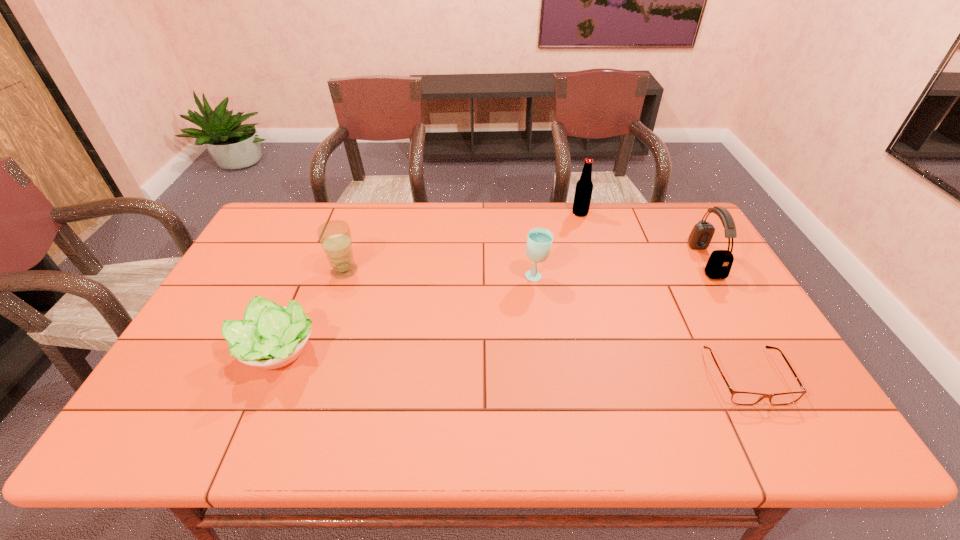
At what (x,y) coordinates should I click in order to perform the action: click on the farthest object. Please return your answer as a coordinate pair (x, y). This screenshot has width=960, height=540. Looking at the image, I should click on (584, 187).

This screenshot has width=960, height=540. Identify the location of beer bottle. (584, 187).

The image size is (960, 540). Find the location of `headset`. headset is located at coordinates (719, 264).

The height and width of the screenshot is (540, 960). In order to click on the left glass in this screenshot , I will do `click(335, 237)`.

Find the location of a particular element. the right glass is located at coordinates (539, 240).

Where is `the fifth tallest object`? the fifth tallest object is located at coordinates (270, 336).

Find the location of a particular element. Image resolution: width=960 pixels, height=540 pixels. spectacles is located at coordinates coord(738,397).

This screenshot has height=540, width=960. Identify the location of free space located on the left of the beer bottle. (462, 213).

At what (x,y) coordinates should I click in order to perform the action: click on free space located 0.320m on the headband of the headset. Please return your answer as a coordinate pair (x, y). This screenshot has height=540, width=960. Looking at the image, I should click on 593,261.

At what (x,y) coordinates should I click in order to perform the action: click on blank area located on the headband of the headset. Please return your answer as a coordinate pair (x, y). This screenshot has height=540, width=960. Looking at the image, I should click on (596, 261).